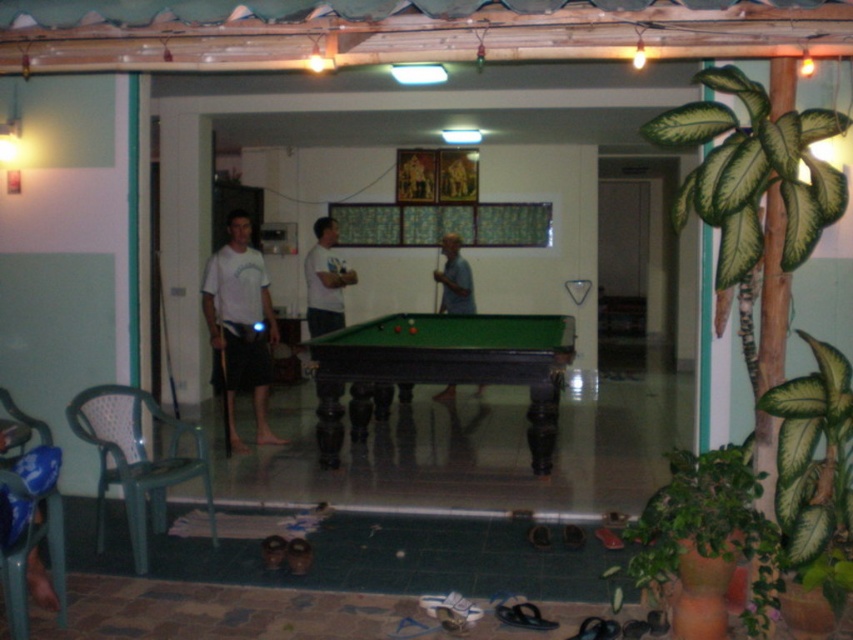
Can you confirm if green matte plant at lower right is wider than white matte shorts at left?

Yes, green matte plant at lower right is wider than white matte shorts at left.

Can you confirm if green matte plant at lower right is positioned above white matte shorts at left?

No, green matte plant at lower right is not above white matte shorts at left.

Is point (659, 524) positioned behind point (215, 346)?

No, (659, 524) is closer to viewer.

At what (x,y) coordinates should I click in order to perform the action: click on green matte plant at lower right. Please return your answer as a coordinate pair (x, y). Looking at the image, I should click on (705, 540).

Does white matte shorts at left have a lesser width compared to white matte shirt at center?

Incorrect, white matte shorts at left's width is not less than white matte shirt at center's.

Is white matte shorts at left below white matte shirt at center?

Indeed, white matte shorts at left is positioned under white matte shirt at center.

Between point (239, 326) and point (320, 305), which one is positioned behind?

The point (320, 305) is more distant.

At what (x,y) coordinates should I click in order to perform the action: click on white matte shorts at left. Please return your answer as a coordinate pair (x, y). Looking at the image, I should click on (239, 324).

Which is more to the left, green matte plant at lower right or matte white shirt at center?

matte white shirt at center

The image size is (853, 640). Describe the element at coordinates (705, 540) in the screenshot. I see `green matte plant at lower right` at that location.

The height and width of the screenshot is (640, 853). What are the coordinates of `green matte plant at lower right` in the screenshot? It's located at (705, 540).